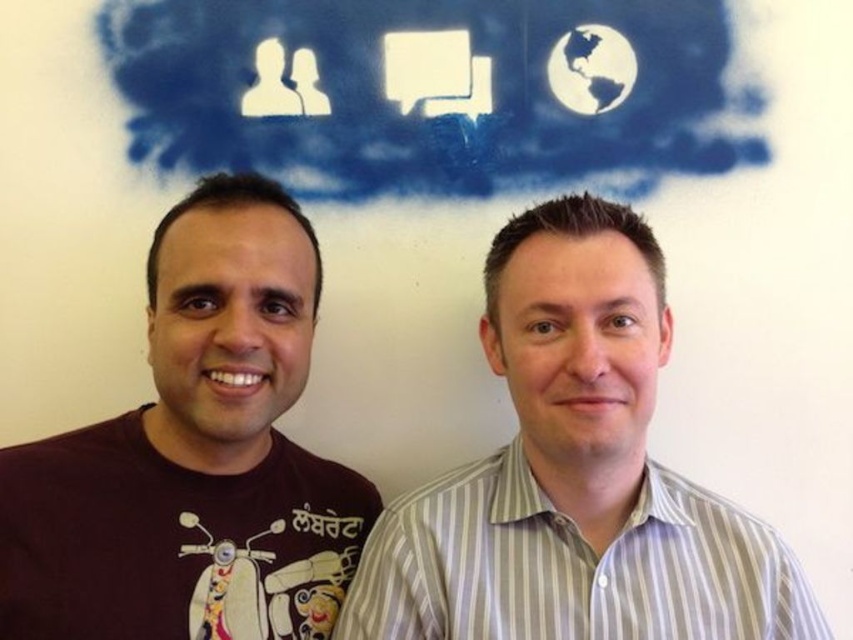
Does white paper cloud at upper center have a greater width compared to brown cotton t-shirt at left?

Correct, the width of white paper cloud at upper center exceeds that of brown cotton t-shirt at left.

The height and width of the screenshot is (640, 853). What do you see at coordinates (431, 92) in the screenshot?
I see `white paper cloud at upper center` at bounding box center [431, 92].

Between point (189, 88) and point (44, 464), which one is positioned in front?

Point (44, 464)

Image resolution: width=853 pixels, height=640 pixels. What are the coordinates of `white paper cloud at upper center` in the screenshot? It's located at (431, 92).

Which is more to the left, white paper cloud at upper center or white striped shirt at center?

white paper cloud at upper center is more to the left.

This screenshot has width=853, height=640. Describe the element at coordinates (431, 92) in the screenshot. I see `white paper cloud at upper center` at that location.

Who is more forward, (x=682, y=77) or (x=585, y=504)?

Point (x=585, y=504) is in front.

I want to click on white paper cloud at upper center, so click(431, 92).

Who is lower down, white striped shirt at center or brown cotton t-shirt at left?

white striped shirt at center is lower down.

Between white striped shirt at center and brown cotton t-shirt at left, which one appears on the left side from the viewer's perspective?

brown cotton t-shirt at left is more to the left.

Which is behind, point (575, 483) or point (71, 552)?

The point (575, 483) is more distant.

I want to click on white striped shirt at center, so click(573, 474).